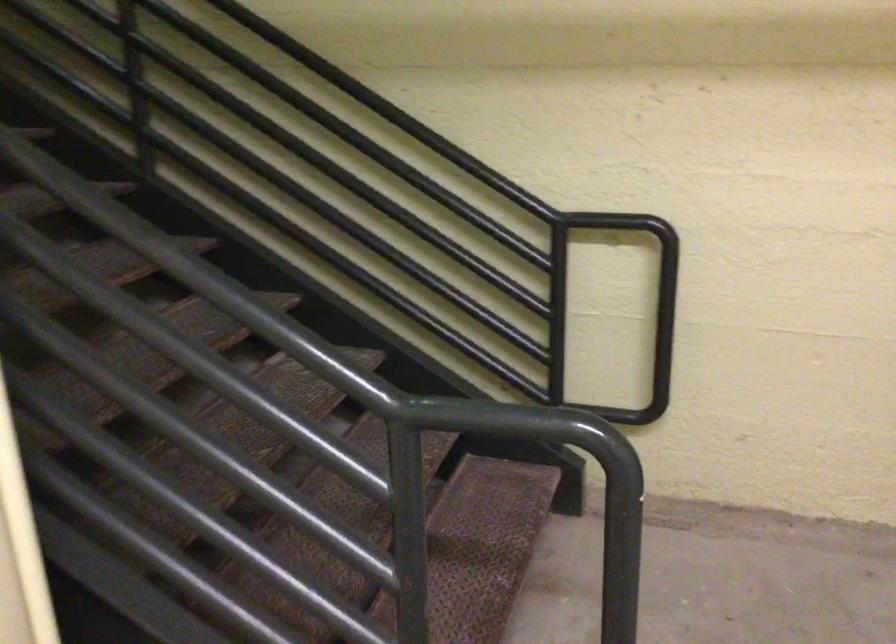
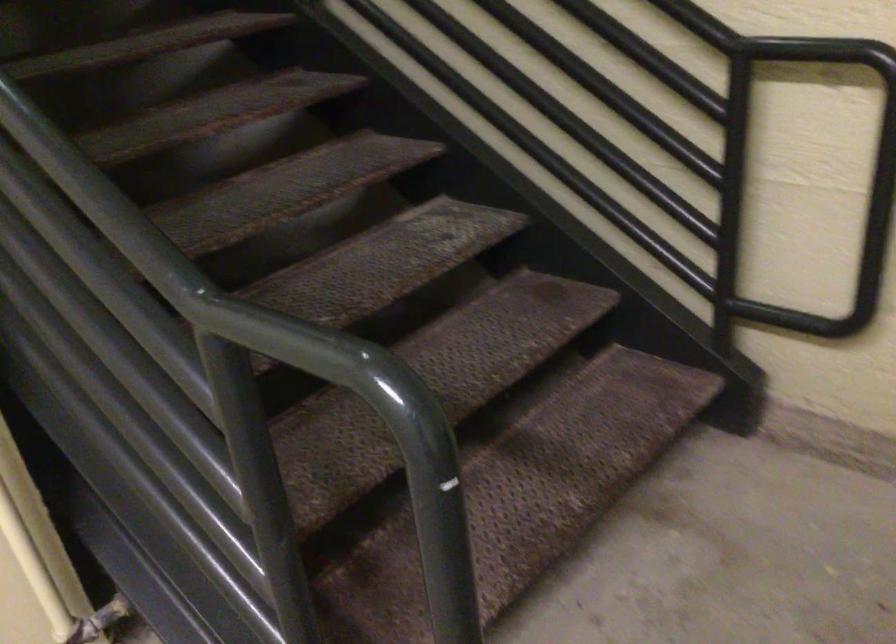
Question: Based on the continuous images, in which direction is the camera rotating? Reply with the corresponding letter.

Choices:
 (A) Left
 (B) Right
 (C) Up
 (D) Down

Answer: (A)